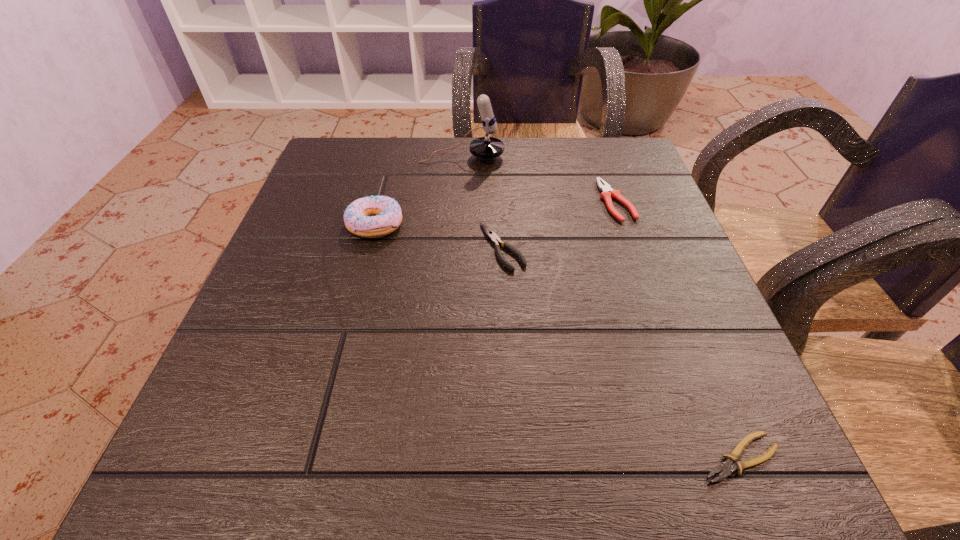
Where is `pliers that can be found as the second closest to the farthest pliers`? pliers that can be found as the second closest to the farthest pliers is located at coordinates (726, 467).

Identify the location of vacant area that satisfies the following two spatial constraints: 1. on the front side of the second tallest object; 2. on the left side of the leftmost pliers. This screenshot has height=540, width=960. (369, 247).

Image resolution: width=960 pixels, height=540 pixels. What are the coordinates of `blank space that satisfies the following two spatial constraints: 1. on the front side of the nearest pliers; 2. on the right side of the farthest pliers` in the screenshot? It's located at (708, 457).

At what (x,y) coordinates should I click in order to perform the action: click on free space that satisfies the following two spatial constraints: 1. on the front side of the nearest pliers; 2. on the right side of the doughnut. Please return your answer as a coordinate pair (x, y). The width and height of the screenshot is (960, 540). Looking at the image, I should click on (314, 457).